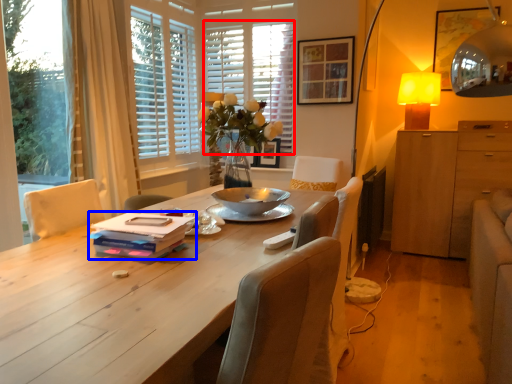
Question: Which object appears closest to the camera in this image, blind (highlighted by a red box) or book (highlighted by a blue box)?

Choices:
 (A) blind
 (B) book

Answer: (B)